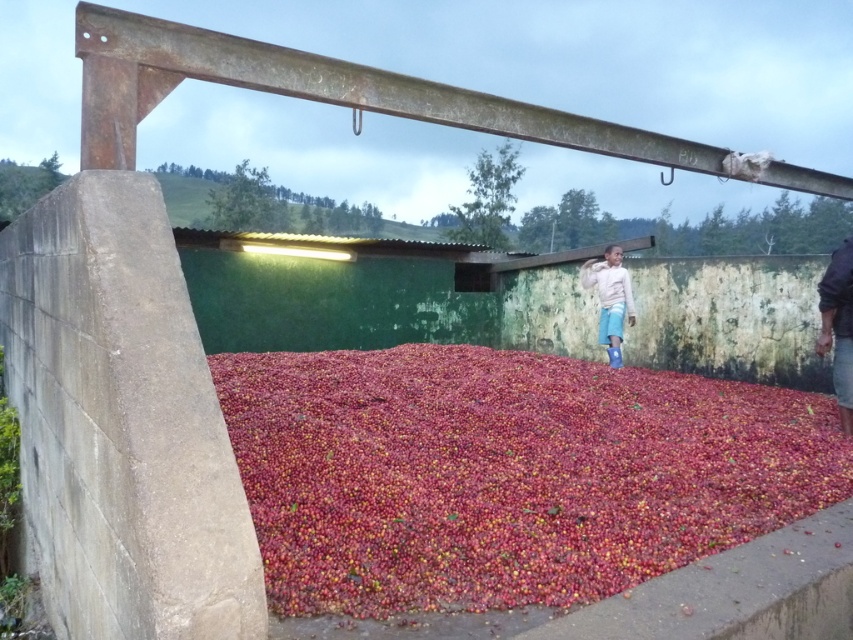
You are a coffee farmer who wants to collect the smooth red berries at center. Where exactly should you go on the platform to find them?

The smooth red berries at center are located at point (506, 474) on the platform.

You are a coffee farmer inspecting the drying process of the coffee cherries. You notice the smooth red berries at center and the dark blue fabric at right. Which object is closer to you from your current position on the platform?

The smooth red berries at center are closer to you than the dark blue fabric at right because they are positioned in front of it.